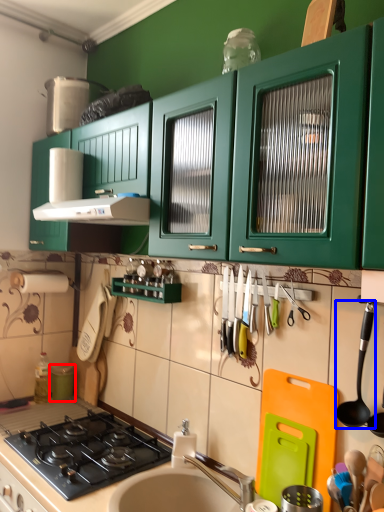
Question: Which point is closer to the camera, appliance (highlighted by a red box) or utensil (highlighted by a blue box)?

Choices:
 (A) appliance
 (B) utensil

Answer: (B)